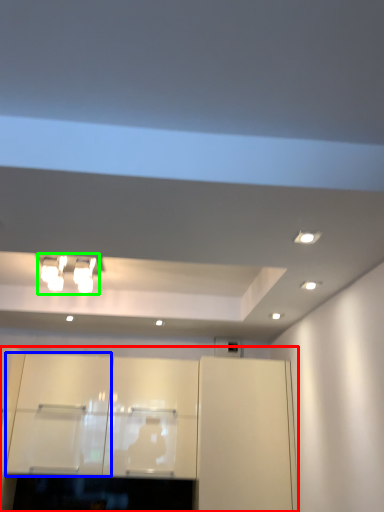
Question: Considering the real-world distances, which object is closest to cabinetry (highlighted by a red box)? cabinetry (highlighted by a blue box) or light fixture (highlighted by a green box).

Choices:
 (A) cabinetry
 (B) light fixture

Answer: (A)